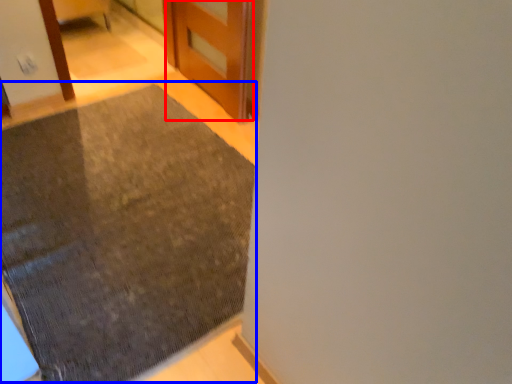
Question: Among these objects, which one is farthest to the camera, door (highlighted by a red box) or mat (highlighted by a blue box)?

Choices:
 (A) door
 (B) mat

Answer: (A)